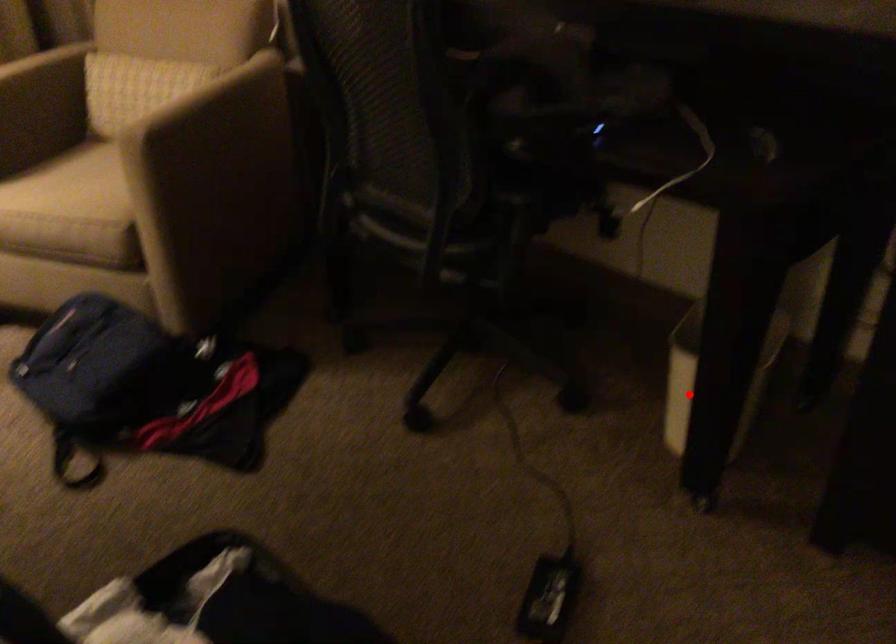
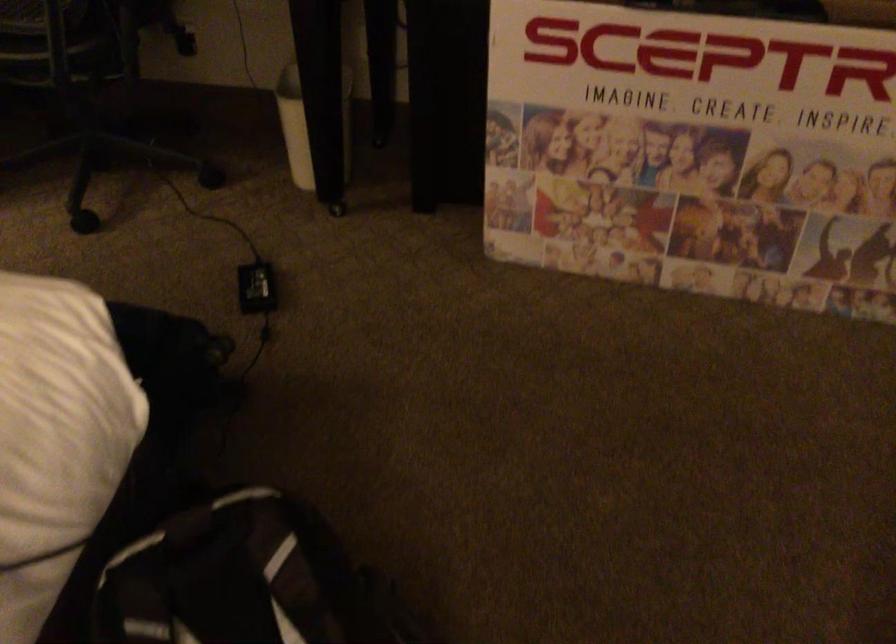
Where in the second image is the point corresponding to the highlighted location from the first image?

(306, 126)